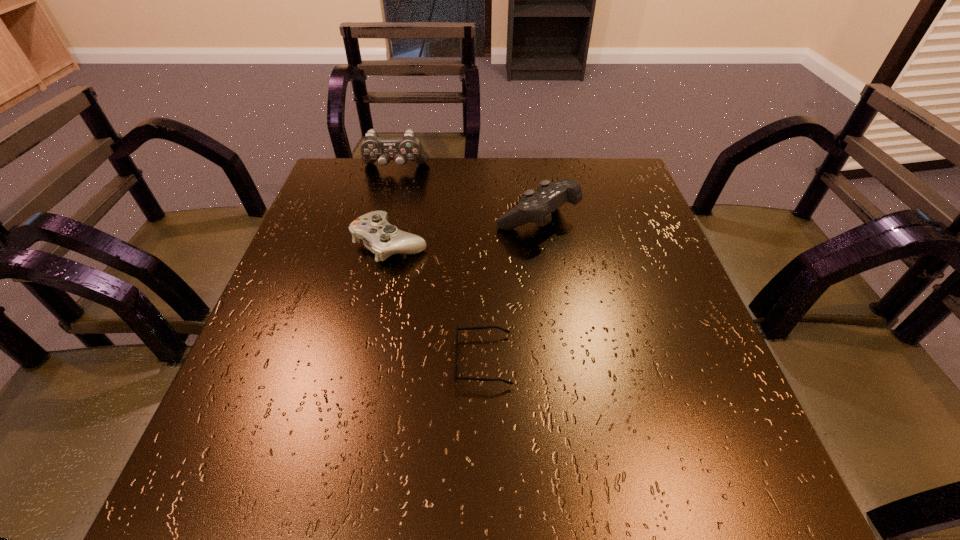
Identify the location of vacant point at the near right corner. (749, 488).

The height and width of the screenshot is (540, 960). What are the coordinates of `unoccupied position between the farthest control and the rightmost control` in the screenshot? It's located at (467, 194).

Image resolution: width=960 pixels, height=540 pixels. I want to click on vacant area that lies between the sunglasses and the shortest control, so click(437, 301).

What are the coordinates of `free space between the farthest control and the rightmost control` in the screenshot? It's located at (467, 194).

You are a GUI agent. You are given a task and a screenshot of the screen. Output one action in this format:
    pyautogui.click(x=<x>, y=<y>)
    Task: Click on the empty space that is in between the shortest object and the farthest control
    This screenshot has height=540, width=960.
    Given the screenshot: What is the action you would take?
    pyautogui.click(x=440, y=265)

Find the location of a particular element. The width and height of the screenshot is (960, 540). empty space between the sunglasses and the third shortest object is located at coordinates (511, 289).

Identify the location of free area in between the sunglasses and the shortest control. This screenshot has width=960, height=540. (437, 301).

Where is `vacant area between the shortest control and the second tallest control`? vacant area between the shortest control and the second tallest control is located at coordinates [x=464, y=231].

Where is `free space between the nearest object and the shortest control`? This screenshot has height=540, width=960. free space between the nearest object and the shortest control is located at coordinates (437, 301).

Locate an element on the screen. The width and height of the screenshot is (960, 540). free space between the shortest control and the sunglasses is located at coordinates (437, 301).